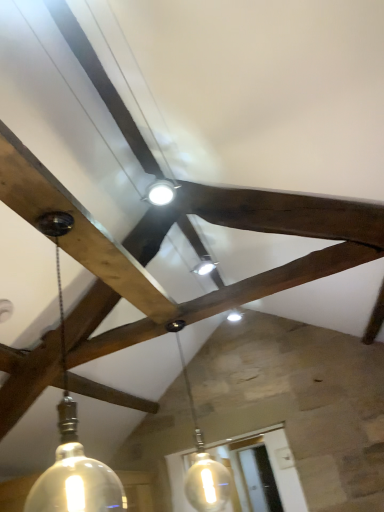
Question: Can we say translucent glass pendant light at center, positioned as the first lamp in back-to-front order, lies outside matte glass pendant light at left, which is the 2th lamp from back to front?

Choices:
 (A) no
 (B) yes

Answer: (B)

Question: Are translucent glass pendant light at center, positioned as the first lamp in back-to-front order, and matte glass pendant light at left, which is the 2th lamp from back to front, making contact?

Choices:
 (A) no
 (B) yes

Answer: (A)

Question: Does translucent glass pendant light at center, positioned as the first lamp in back-to-front order, have a larger size compared to matte glass pendant light at left, acting as the first lamp starting from the front?

Choices:
 (A) yes
 (B) no

Answer: (A)

Question: From the image's perspective, is translucent glass pendant light at center, the 2th lamp viewed from the front, on matte glass pendant light at left, acting as the first lamp starting from the front?

Choices:
 (A) yes
 (B) no

Answer: (B)

Question: Considering the relative sizes of translucent glass pendant light at center, positioned as the first lamp in back-to-front order, and matte glass pendant light at left, which is the 2th lamp from back to front, in the image provided, is translucent glass pendant light at center, positioned as the first lamp in back-to-front order, taller than matte glass pendant light at left, which is the 2th lamp from back to front,?

Choices:
 (A) yes
 (B) no

Answer: (A)

Question: Considering the relative sizes of translucent glass pendant light at center, positioned as the first lamp in back-to-front order, and matte glass pendant light at left, which is the 2th lamp from back to front, in the image provided, is translucent glass pendant light at center, positioned as the first lamp in back-to-front order, thinner than matte glass pendant light at left, which is the 2th lamp from back to front,?

Choices:
 (A) yes
 (B) no

Answer: (A)

Question: Is matte glass pendant light at left, acting as the first lamp starting from the front, bigger than translucent glass pendant light at center, the 2th lamp viewed from the front?

Choices:
 (A) no
 (B) yes

Answer: (A)

Question: Is matte glass pendant light at left, which is the 2th lamp from back to front, closer to camera compared to translucent glass pendant light at center, the 2th lamp viewed from the front?

Choices:
 (A) no
 (B) yes

Answer: (B)

Question: Considering the relative sizes of matte glass pendant light at left, acting as the first lamp starting from the front, and translucent glass pendant light at center, the 2th lamp viewed from the front, in the image provided, is matte glass pendant light at left, acting as the first lamp starting from the front, shorter than translucent glass pendant light at center, the 2th lamp viewed from the front,?

Choices:
 (A) yes
 (B) no

Answer: (A)

Question: Could translucent glass pendant light at center, positioned as the first lamp in back-to-front order, be considered to be inside matte glass pendant light at left, acting as the first lamp starting from the front?

Choices:
 (A) no
 (B) yes

Answer: (A)

Question: Is matte glass pendant light at left, which is the 2th lamp from back to front, located outside translucent glass pendant light at center, positioned as the first lamp in back-to-front order?

Choices:
 (A) yes
 (B) no

Answer: (A)

Question: From the image's perspective, is matte glass pendant light at left, which is the 2th lamp from back to front, located beneath translucent glass pendant light at center, positioned as the first lamp in back-to-front order?

Choices:
 (A) no
 (B) yes

Answer: (A)

Question: In terms of height, does matte glass pendant light at left, which is the 2th lamp from back to front, look taller or shorter compared to translucent glass pendant light at center, the 2th lamp viewed from the front?

Choices:
 (A) short
 (B) tall

Answer: (A)